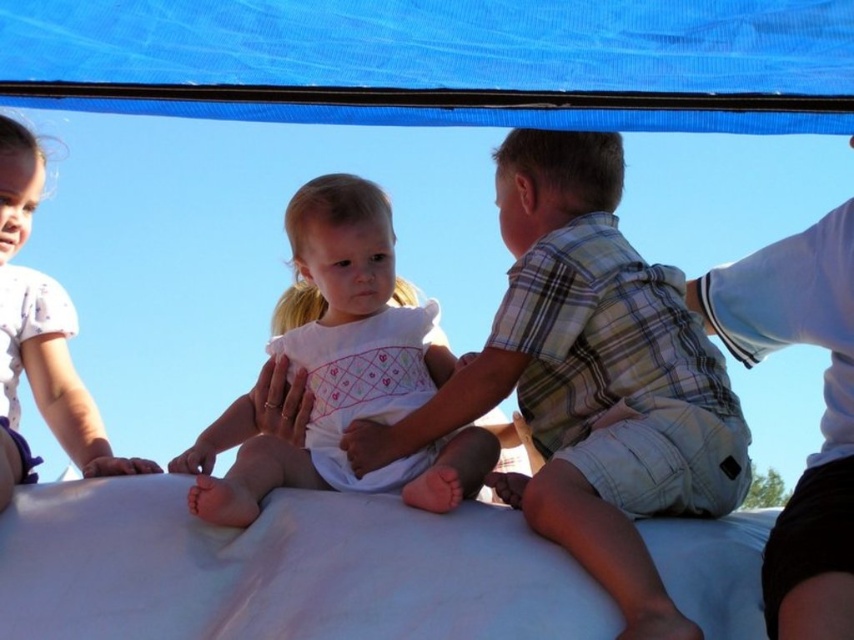
Question: Which object is positioned farthest from the blue fabric canopy at upper center?

Choices:
 (A) white cotton shirt at left
 (B) plaid cotton shirt at center

Answer: (A)

Question: Based on their relative distances, which object is farther from the plaid cotton shirt at center?

Choices:
 (A) white cotton shirt at left
 (B) blue fabric canopy at upper center
 (C) white cotton dress at center

Answer: (A)

Question: Is white cotton dress at center thinner than white cotton shirt at left?

Choices:
 (A) no
 (B) yes

Answer: (A)

Question: Is the position of plaid cotton shirt at center more distant than that of white cotton shirt at left?

Choices:
 (A) no
 (B) yes

Answer: (A)

Question: Can you confirm if blue fabric canopy at upper center is thinner than white cotton dress at center?

Choices:
 (A) yes
 (B) no

Answer: (B)

Question: Which point is closer to the camera?

Choices:
 (A) (741, 3)
 (B) (595, 340)
 (C) (20, 204)

Answer: (B)